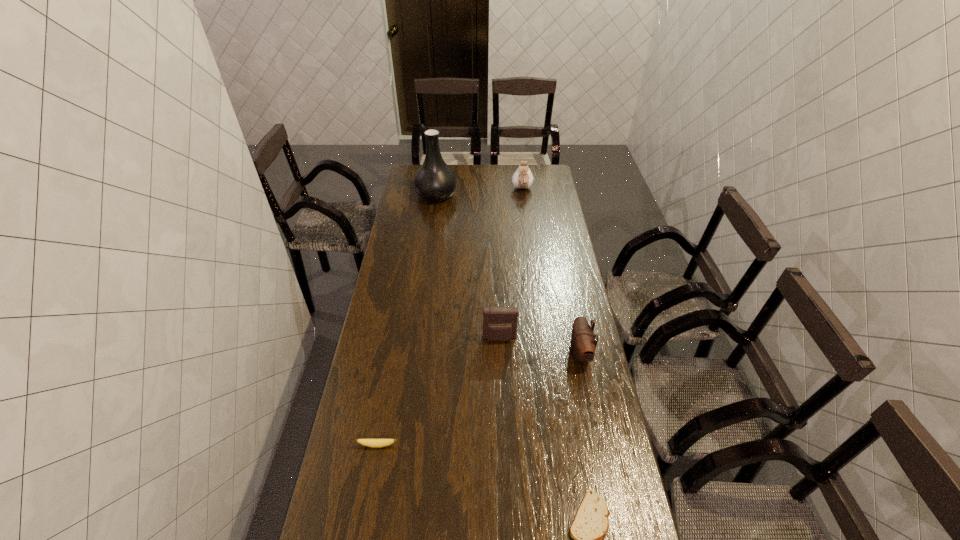
In the image, there is a desktop. At what (x,y) coordinates should I click in order to perform the action: click on blank space at the right edge. Please return your answer as a coordinate pair (x, y). Image resolution: width=960 pixels, height=540 pixels. Looking at the image, I should click on (564, 288).

Where is `vacant space at the far left corner`? Image resolution: width=960 pixels, height=540 pixels. vacant space at the far left corner is located at coordinates (413, 167).

Find the location of a particular element. free space at the far right corner of the desktop is located at coordinates (545, 176).

Locate an element on the screen. The image size is (960, 540). free space between the rightmost pouch and the second pouch from left to right is located at coordinates (551, 271).

This screenshot has height=540, width=960. I want to click on free space between the banana and the tallest object, so (407, 320).

I want to click on vacant point located between the rightmost pouch and the tallest object, so [508, 274].

Identify the location of free point between the farthest pouch and the rightmost pouch. pyautogui.click(x=551, y=271).

The width and height of the screenshot is (960, 540). Identify the location of empty space that is in between the second pouch from left to right and the fourth object from right to left. (511, 264).

This screenshot has width=960, height=540. I want to click on free area in between the banana and the second pouch from left to right, so click(450, 317).

Find the location of `blank region between the tallest object and the rightmost pouch`. blank region between the tallest object and the rightmost pouch is located at coordinates click(508, 274).